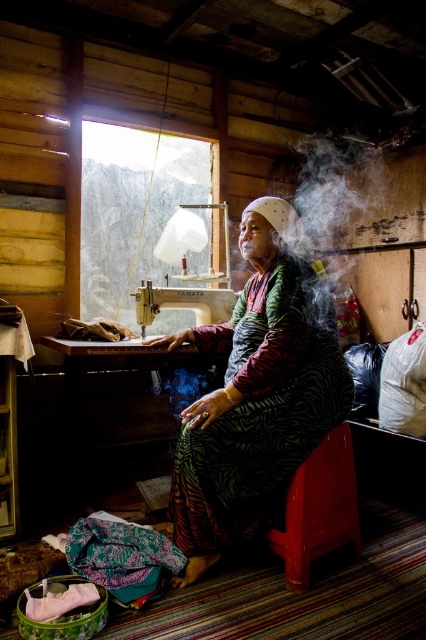
Question: Can you confirm if shiny plastic stool at lower center is bigger than metallic sewing machine at left?

Choices:
 (A) yes
 (B) no

Answer: (B)

Question: Can you confirm if green zebra-patterned dress at center is wider than metallic sewing machine at left?

Choices:
 (A) no
 (B) yes

Answer: (B)

Question: Does shiny plastic stool at lower center appear on the right side of metallic sewing machine at left?

Choices:
 (A) yes
 (B) no

Answer: (A)

Question: Which point is closer to the camera?

Choices:
 (A) (288, 515)
 (B) (175, 296)

Answer: (A)

Question: Based on their relative distances, which object is farther from the white smoke at upper center?

Choices:
 (A) metallic sewing machine at left
 (B) green zebra-patterned dress at center

Answer: (B)

Question: Which of the following is the farthest from the observer?

Choices:
 (A) (198, 289)
 (B) (351, 500)

Answer: (A)